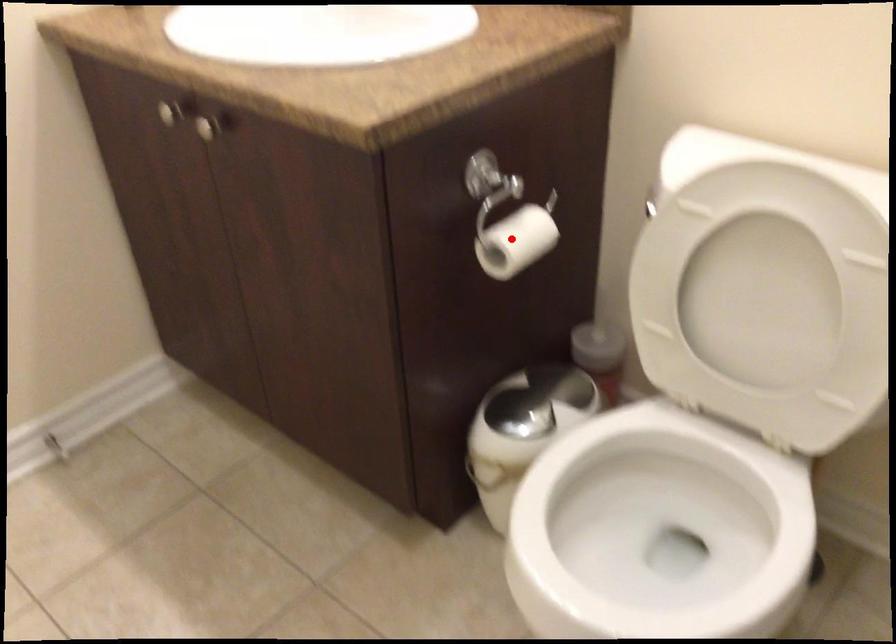
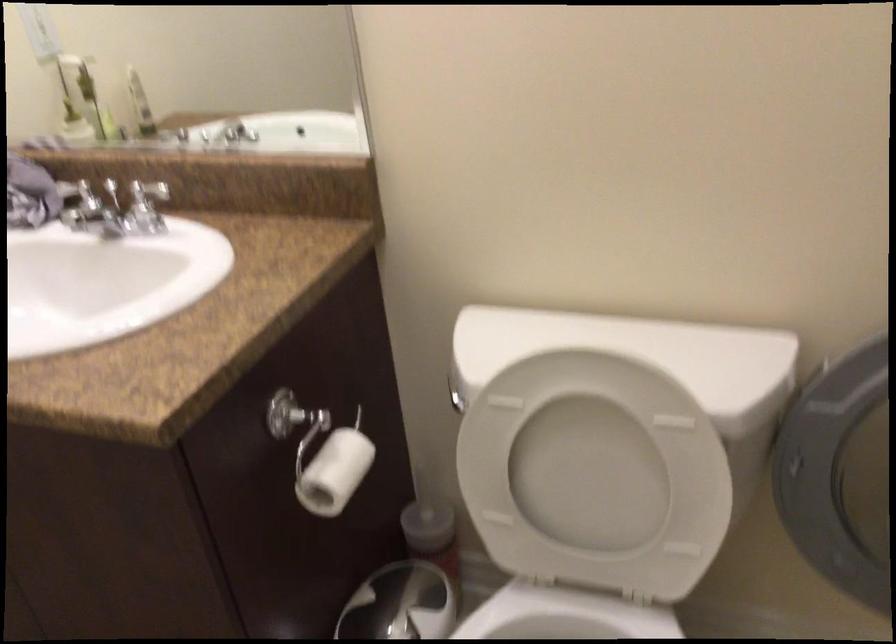
The point at the highlighted location is marked in the first image. Where is the corresponding point in the second image?

(334, 471)